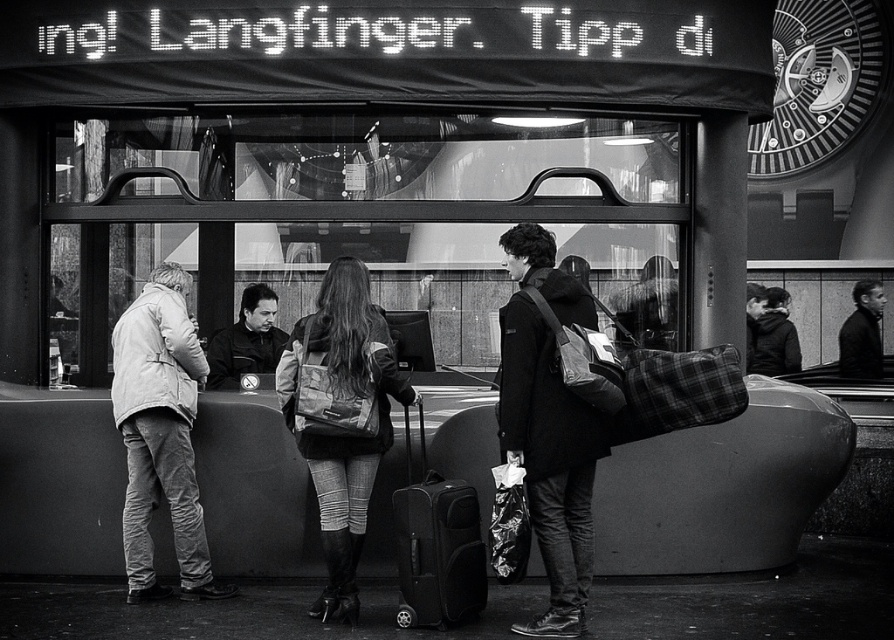
Can you confirm if matte black backpack at center is smaller than smooth black jacket at center?

Correct, matte black backpack at center occupies less space than smooth black jacket at center.

Consider the image. Which is more to the right, matte black backpack at center or smooth black jacket at center?

smooth black jacket at center is more to the right.

Is point (541, 528) farther from viewer compared to point (881, 304)?

No, (541, 528) is in front of (881, 304).

I want to click on matte black backpack at center, so click(x=549, y=424).

Locate an element on the screen. matte black backpack at center is located at coordinates 549,424.

Which of these two, matte black backpack at center or dark fabric jacket at center, stands shorter?

With less height is dark fabric jacket at center.

Which is in front, point (604, 435) or point (757, 368)?

Point (604, 435)

Where is `matte black backpack at center`? The width and height of the screenshot is (894, 640). matte black backpack at center is located at coordinates (549, 424).

Can you confirm if leather jacket at center is positioned to the right of smooth black jacket at center?

No, leather jacket at center is not to the right of smooth black jacket at center.

Between leather jacket at center and smooth black jacket at center, which one appears on the left side from the viewer's perspective?

Positioned to the left is leather jacket at center.

Is point (344, 490) farther from viewer compared to point (862, 362)?

No.

You are a GUI agent. You are given a task and a screenshot of the screen. Output one action in this format:
    pyautogui.click(x=<x>, y=<y>)
    Task: Click on the leather jacket at center
    The width and height of the screenshot is (894, 640).
    Given the screenshot: What is the action you would take?
    pyautogui.click(x=342, y=433)